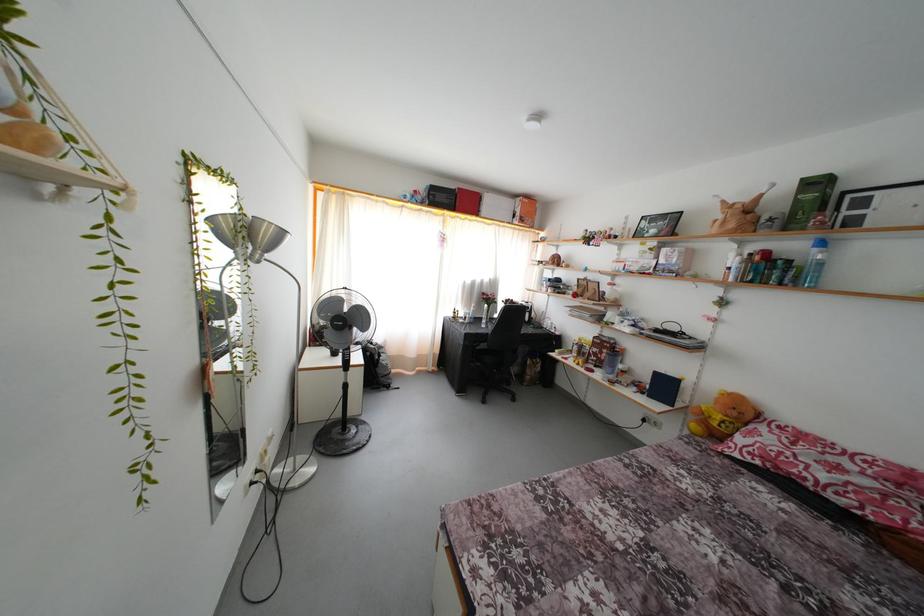
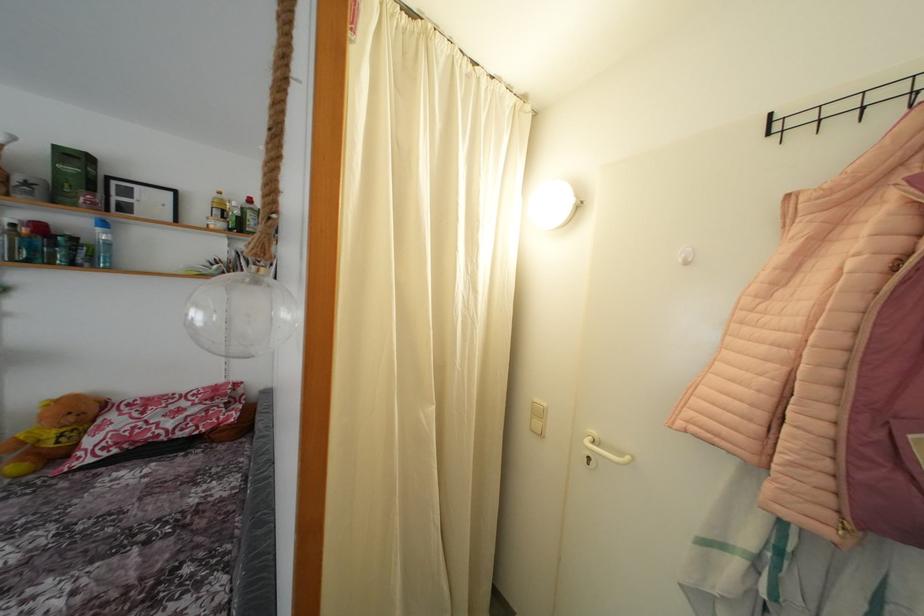
Locate, in the second image, the point that corresponds to (x=822, y=188) in the first image.

(80, 163)